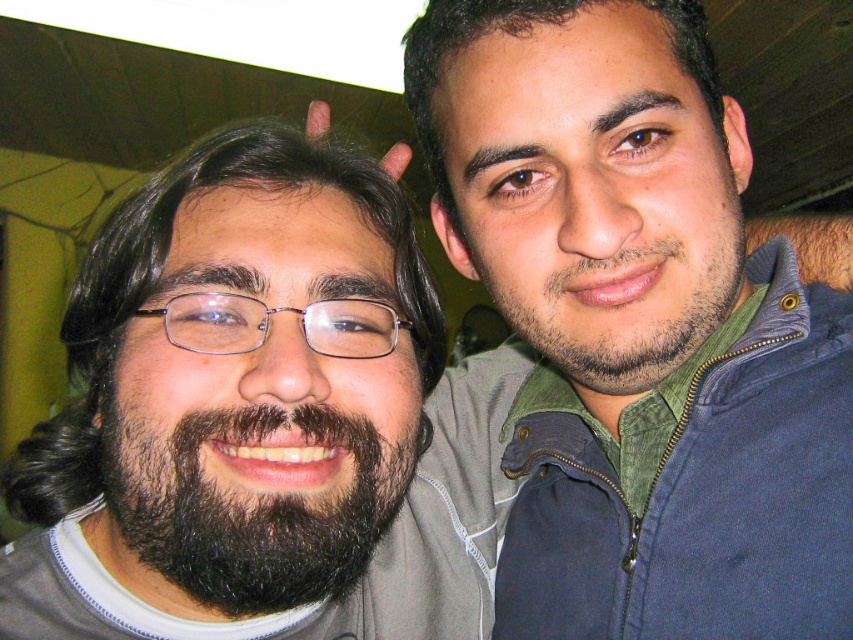
Is dark blue zip-up jacket at center positioned at the back of black fuzzy beard at left?

Yes.

Is dark blue zip-up jacket at center taller than black fuzzy beard at left?

Yes, dark blue zip-up jacket at center is taller than black fuzzy beard at left.

The height and width of the screenshot is (640, 853). I want to click on dark blue zip-up jacket at center, so click(x=637, y=326).

Find the location of a particular element. This screenshot has height=640, width=853. dark blue zip-up jacket at center is located at coordinates 637,326.

Which is more to the left, dark blue zip-up jacket at center or dark brown hair at center?

dark brown hair at center

This screenshot has width=853, height=640. What do you see at coordinates (637, 326) in the screenshot? I see `dark blue zip-up jacket at center` at bounding box center [637, 326].

Looking at this image, measure the distance between point (618, 291) and camera.

They are 48.20 centimeters apart.

Locate an element on the screen. dark blue zip-up jacket at center is located at coordinates (637, 326).

Who is higher up, black fuzzy beard at left or dark brown stubble at center?

Positioned higher is dark brown stubble at center.

This screenshot has width=853, height=640. I want to click on black fuzzy beard at left, so click(252, 500).

I want to click on black fuzzy beard at left, so click(x=252, y=500).